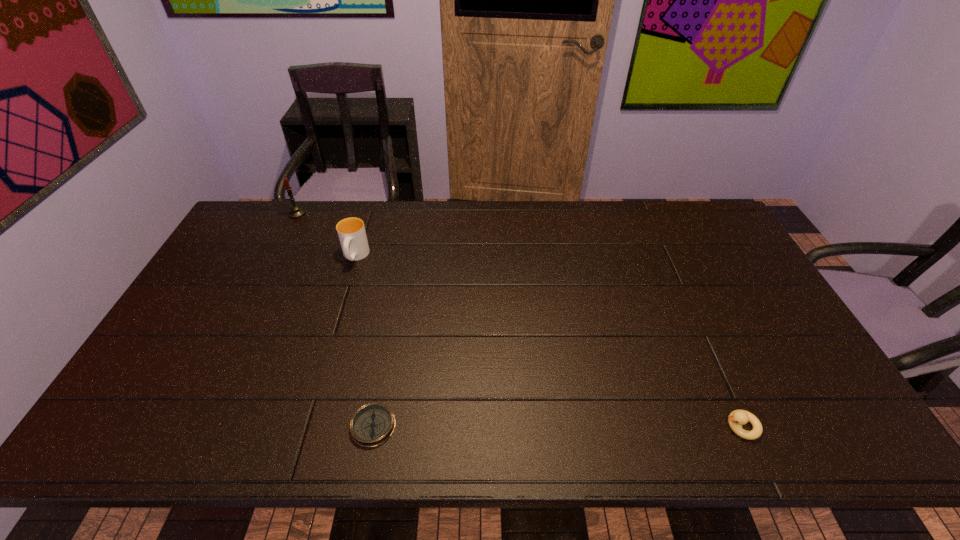
The image size is (960, 540). Find the location of `vacant space that satisfies the following two spatial constraints: 1. on the front side of the candle; 2. on the left side of the third object from left to right`. vacant space that satisfies the following two spatial constraints: 1. on the front side of the candle; 2. on the left side of the third object from left to right is located at coordinates (190, 426).